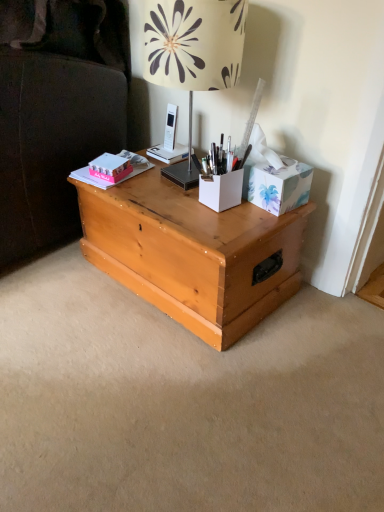
Locate an element on the screen. free space in front of pink matte box at upper left is located at coordinates (138, 193).